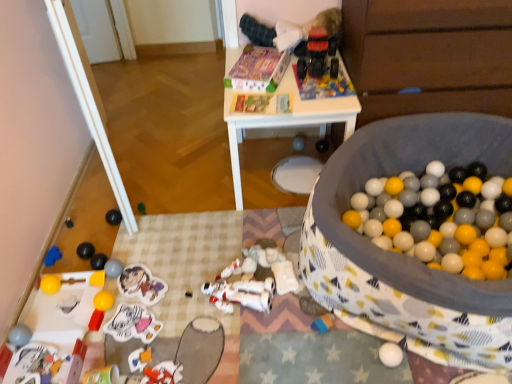
This screenshot has height=384, width=512. I want to click on free location to the right of white matte robot at center, placed as the 7th toy when sorted from right to left, so click(x=296, y=300).